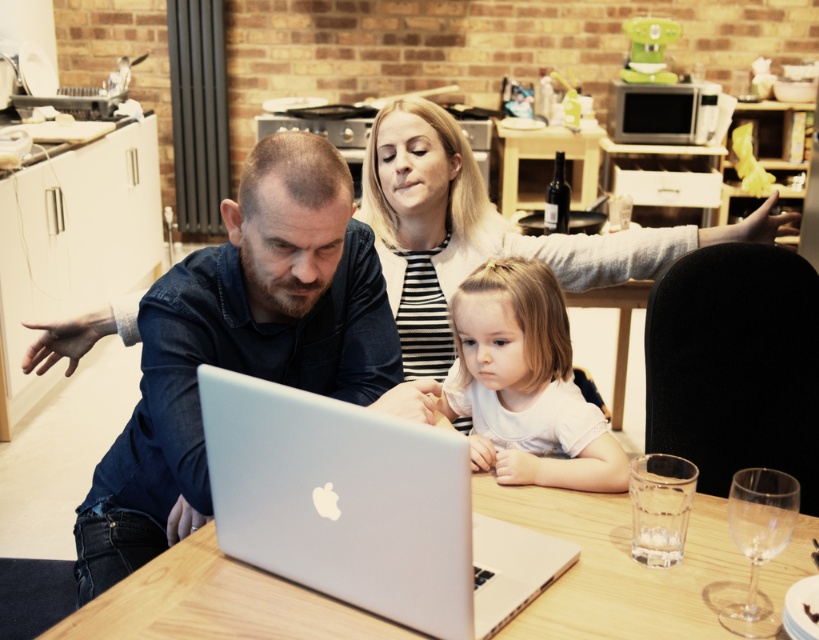
Is the position of matte blue shirt at center more distant than that of white striped shirt at upper center?

No.

Measure the distance from matte blue shirt at center to white striped shirt at upper center.

The distance of matte blue shirt at center from white striped shirt at upper center is 27.68 inches.

Who is more distant from viewer, [252,205] or [396,193]?

Point [396,193]

Locate an element on the screen. The image size is (819, 640). matte blue shirt at center is located at coordinates (238, 346).

Can you confirm if silver metallic laptop at center is positioned to the left of white striped shirt at upper center?

Correct, you'll find silver metallic laptop at center to the left of white striped shirt at upper center.

From the picture: Can you confirm if silver metallic laptop at center is positioned above white striped shirt at upper center?

Actually, silver metallic laptop at center is below white striped shirt at upper center.

Which is in front, point (448, 547) or point (460, 156)?

Point (448, 547)

What are the coordinates of `silver metallic laptop at center` in the screenshot? It's located at (364, 509).

Which is above, matte blue shirt at center or white matte shirt at center?

Positioned higher is matte blue shirt at center.

Who is positioned more to the right, matte blue shirt at center or white matte shirt at center?

white matte shirt at center is more to the right.

This screenshot has height=640, width=819. What do you see at coordinates (238, 346) in the screenshot?
I see `matte blue shirt at center` at bounding box center [238, 346].

Locate an element on the screen. matte blue shirt at center is located at coordinates (238, 346).